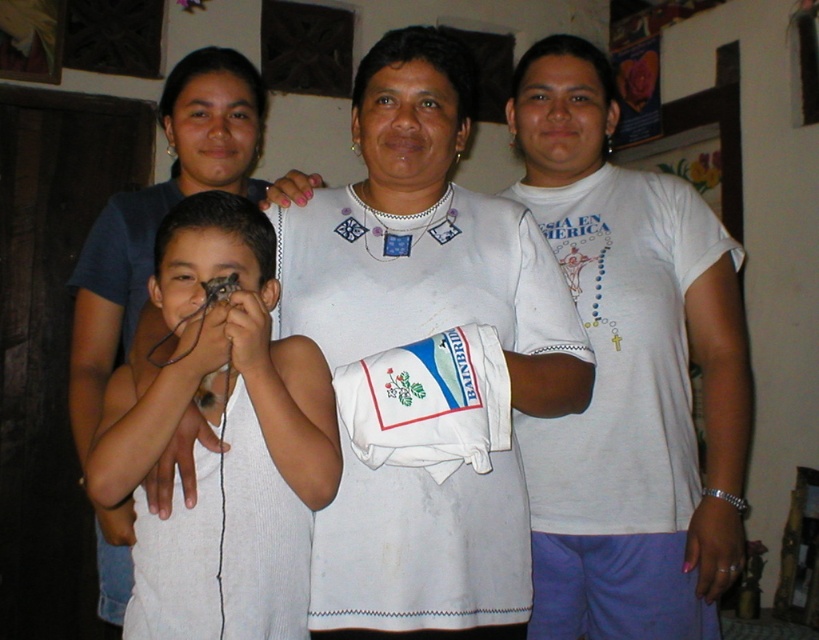
Question: Which of the following is the closest to the observer?

Choices:
 (A) (311, 250)
 (B) (238, 422)
 (C) (613, 561)

Answer: (B)

Question: Which of the following is the closest to the observer?

Choices:
 (A) white cotton shirt at center
 (B) white embroidered dress at center

Answer: (B)

Question: Does white embroidered dress at center have a greater width compared to white cotton shirt at center?

Choices:
 (A) no
 (B) yes

Answer: (B)

Question: Observing the image, what is the correct spatial positioning of white cotton shirt at center in reference to white knitted tank top at center?

Choices:
 (A) below
 (B) above

Answer: (B)

Question: Estimate the real-world distances between objects in this image. Which object is closer to the white embroidered dress at center?

Choices:
 (A) white knitted tank top at center
 (B) white cotton shirt at center

Answer: (A)

Question: Observing the image, what is the correct spatial positioning of white embroidered dress at center in reference to white cotton shirt at center?

Choices:
 (A) right
 (B) left

Answer: (B)